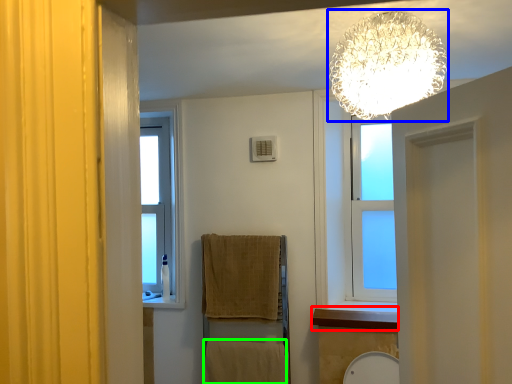
Question: Considering the real-world distances, which object is closest to window sill (highlighted by a red box)? lamp (highlighted by a blue box) or bath towel (highlighted by a green box).

Choices:
 (A) lamp
 (B) bath towel

Answer: (B)